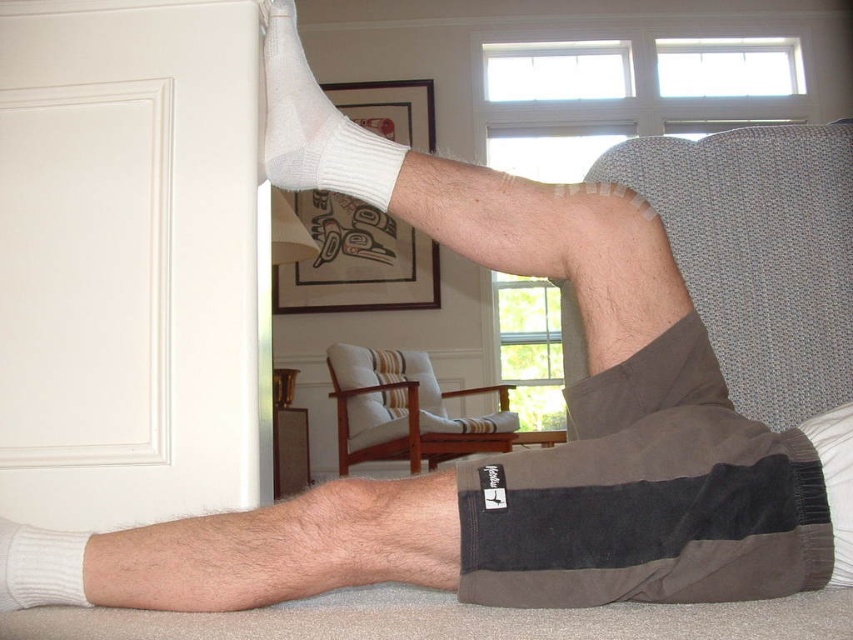
You are trying to match socks for laundry. You have two socks in front of you, the white cotton sock at upper left and the white knitted sock at lower left. Which sock should you choose if you want to wear the taller one?

The white cotton sock at upper left is taller than the white knitted sock at lower left, so you should choose the white cotton sock at upper left.

You are a tailor measuring socks for a customer. You have two socks in front of you, the white cotton sock at upper left and the white knitted sock at lower left. Which sock should you recommend if the customer prefers a wider fit?

The white cotton sock at upper left has a larger width than the white knitted sock at lower left, so it would be the better recommendation for a wider fit.

You are a photographer setting up a camera at the center of the room. You want to focus on the white cotton sock at upper left. Based on its position, which direction should you point the camera to capture it?

The white cotton sock at upper left is located at point [317,125], which is to the left and slightly below the center of the room. Therefore, you should point the camera to the left and slightly downward to capture it.